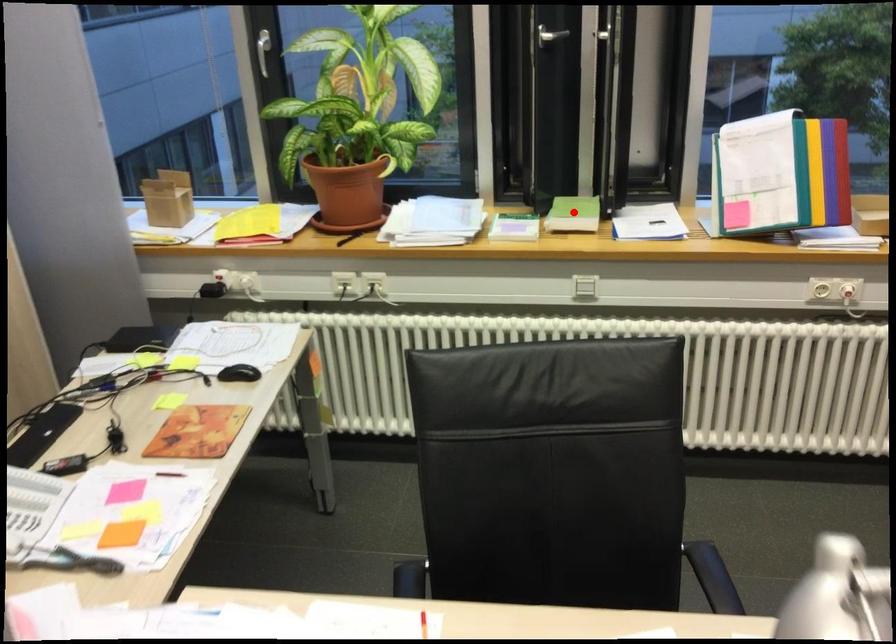
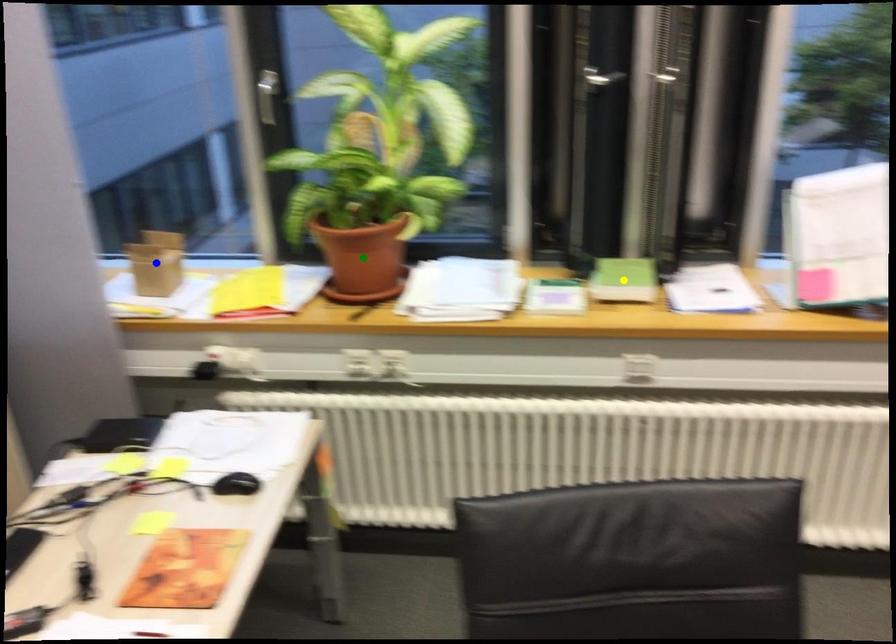
Question: I am providing you with two images of the same scene from different viewpoints. A red point is marked on the first image. You are given multiple points on the second image. Which mark in image 2 goes with the point in image 1?

Choices:
 (A) blue point
 (B) yellow point
 (C) green point

Answer: (B)